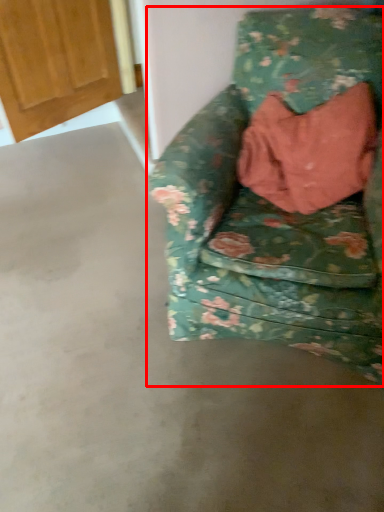
Question: From the image's perspective, where is chair (annotated by the red box) located relative to door?

Choices:
 (A) below
 (B) above

Answer: (A)